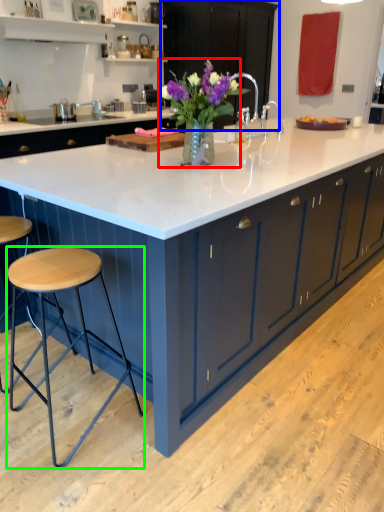
Question: Based on their relative distances, which object is nearer to floral arrangement (highlighted by a red box)? Choose from cabinetry (highlighted by a blue box) and stool (highlighted by a green box).

Choices:
 (A) cabinetry
 (B) stool

Answer: (B)